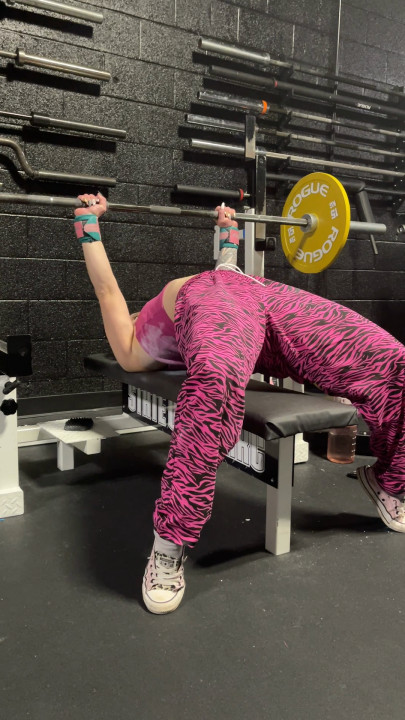
In order to click on brick wall in this screenshot , I will do tap(150, 168).